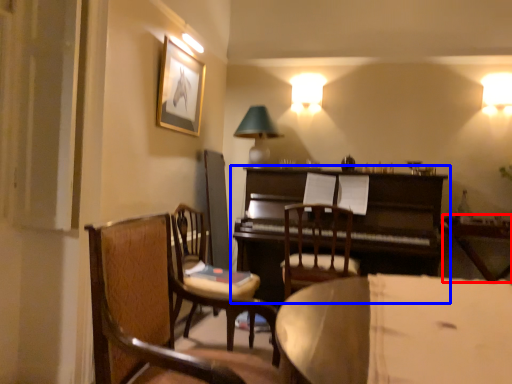
Question: Which object appears farthest to the camera in this image, table (highlighted by a red box) or piano (highlighted by a blue box)?

Choices:
 (A) table
 (B) piano

Answer: (B)